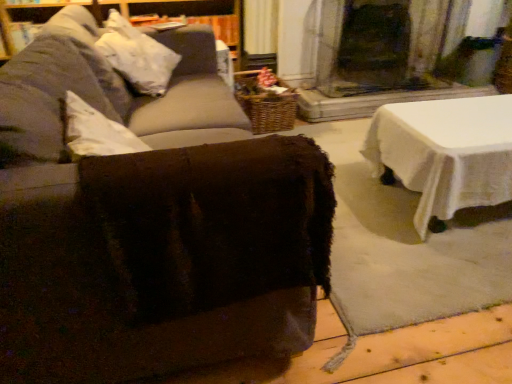
The width and height of the screenshot is (512, 384). What are the coordinates of `vacant area that lies to the right of woven brown basket at center` in the screenshot? It's located at (332, 128).